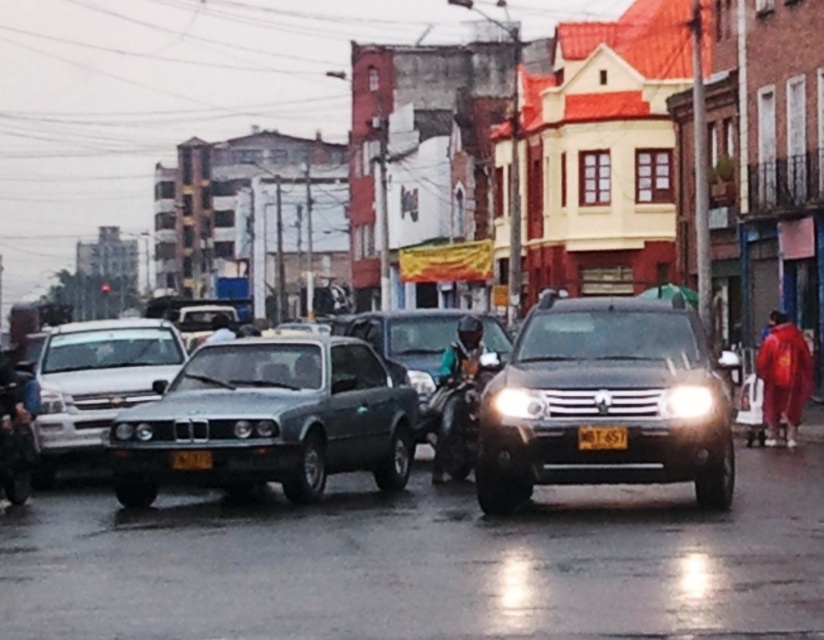
In the scene shown: Can you confirm if silver metallic sedan at center is wider than glossy plastic headlight at center?

Indeed, silver metallic sedan at center has a greater width compared to glossy plastic headlight at center.

Between silver metallic sedan at center and glossy plastic headlight at center, which one appears on the right side from the viewer's perspective?

From the viewer's perspective, glossy plastic headlight at center appears more on the right side.

Which is behind, point (106, 397) or point (672, 413)?

Point (106, 397)

I want to click on silver metallic sedan at center, so click(96, 381).

Can you confirm if satin silver car at center is smaller than glossy plastic headlight at center?

No.

Which is more to the right, satin silver car at center or glossy plastic headlight at center?

From the viewer's perspective, glossy plastic headlight at center appears more on the right side.

Is point (298, 371) closer to viewer compared to point (667, 388)?

No, it is behind (667, 388).

You are a GUI agent. You are given a task and a screenshot of the screen. Output one action in this format:
    pyautogui.click(x=<x>, y=<y>)
    Task: Click on the satin silver car at center
    
    Given the screenshot: What is the action you would take?
    pyautogui.click(x=269, y=420)

At what (x,y) coordinates should I click in order to perform the action: click on metallic silver motorcycle at lower left. Please return your answer as a coordinate pair (x, y). This screenshot has height=640, width=824. Looking at the image, I should click on (13, 436).

Who is shorter, metallic silver motorcycle at lower left or matte black headlight at center?

matte black headlight at center

Image resolution: width=824 pixels, height=640 pixels. Identify the location of metallic silver motorcycle at lower left. (13, 436).